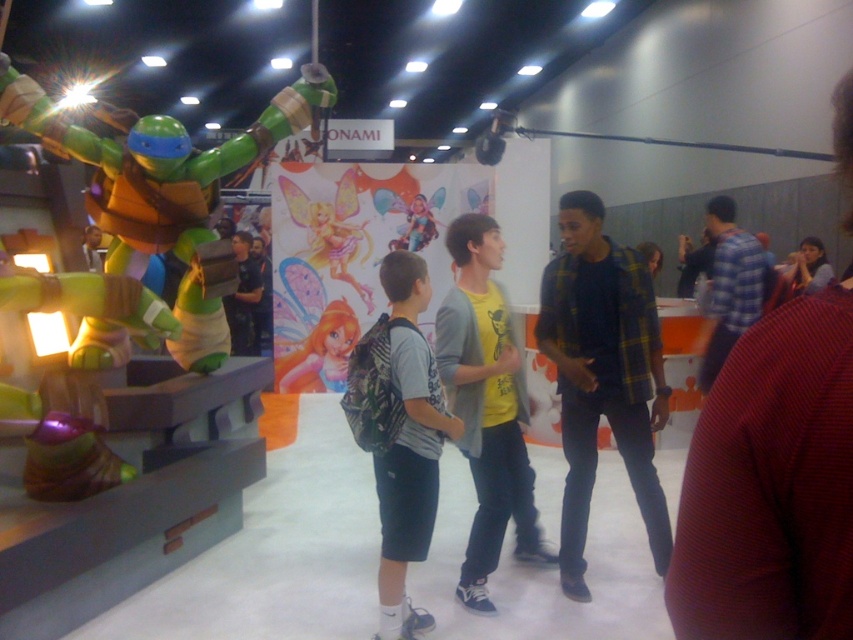
Is green matte turtle at left positioned behind pastel pink fairy at center?

No, it is not.

Looking at this image, is green matte turtle at left bigger than pastel pink fairy at center?

Correct, green matte turtle at left is larger in size than pastel pink fairy at center.

Where is `green matte turtle at left`? Image resolution: width=853 pixels, height=640 pixels. green matte turtle at left is located at coordinates (163, 186).

Who is taller, plaid shirt at center or yellow matte t-shirt at center?

yellow matte t-shirt at center

Does plaid shirt at center appear over yellow matte t-shirt at center?

Indeed, plaid shirt at center is positioned over yellow matte t-shirt at center.

What are the coordinates of `plaid shirt at center` in the screenshot? It's located at (770, 484).

Measure the distance from plaid shirt at center to smooth skin face at upper right.

5.67 meters

Can you confirm if plaid shirt at center is positioned to the right of smooth skin face at upper right?

In fact, plaid shirt at center is to the left of smooth skin face at upper right.

Which is in front, point (837, 150) or point (799, 259)?

Point (837, 150) is more forward.

This screenshot has width=853, height=640. Find the location of `plaid shirt at center`. plaid shirt at center is located at coordinates (770, 484).